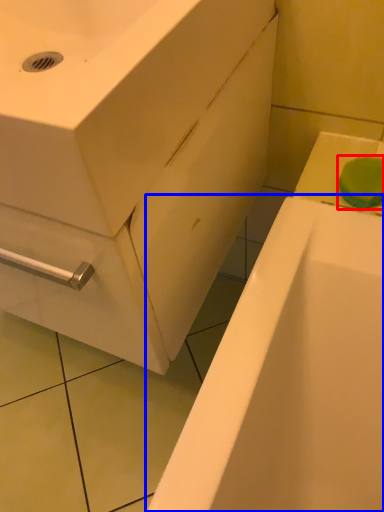
Question: Which point is closer to the camera, soap (highlighted by a red box) or bathtub (highlighted by a blue box)?

Choices:
 (A) soap
 (B) bathtub

Answer: (A)